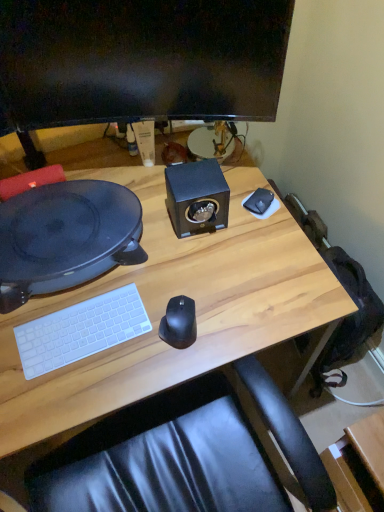
At what (x,y) coordinates should I click in order to perform the action: click on vacant space behind white matte mousepad at upper right. Please return your answer as a coordinate pair (x, y). The width and height of the screenshot is (384, 512). Looking at the image, I should click on (236, 170).